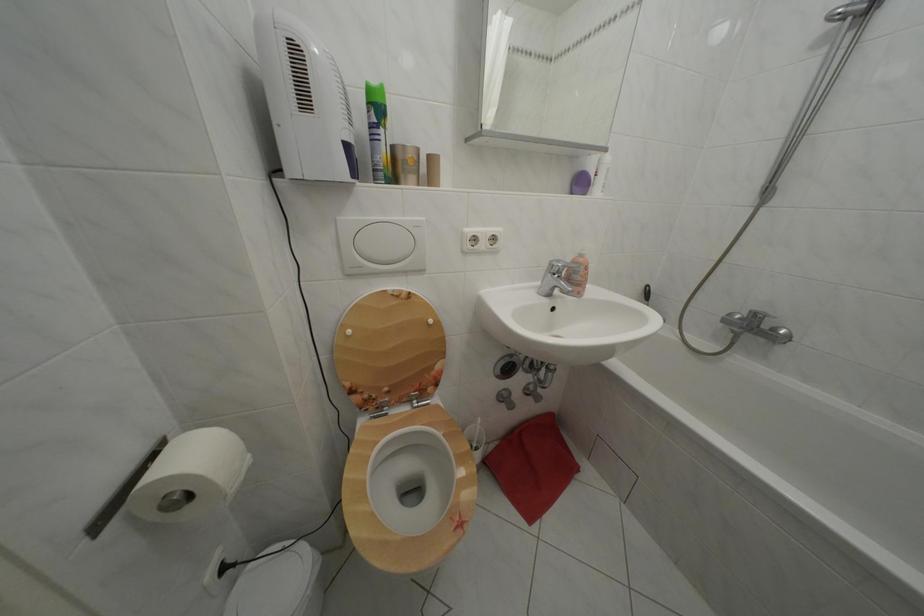
Find where to push the green spray can. Please return your answer as a coordinate pair (x, y).

(378, 131)